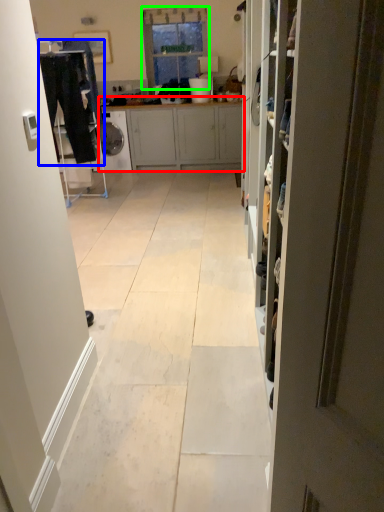
Question: Which is nearer to the cabinetry (highlighted by a red box)? laundry (highlighted by a blue box) or window (highlighted by a green box).

Choices:
 (A) laundry
 (B) window

Answer: (B)